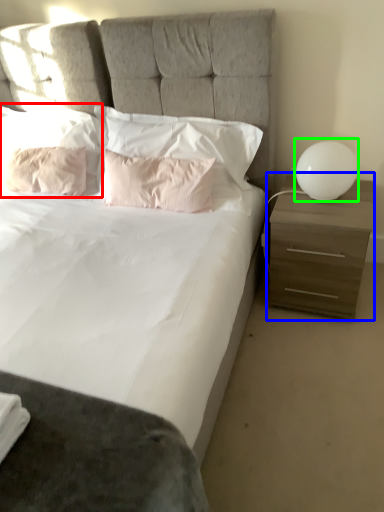
Question: Which object is positioned farthest from pillow (highlighted by a red box)? Select from nightstand (highlighted by a blue box) and table lamp (highlighted by a green box).

Choices:
 (A) nightstand
 (B) table lamp

Answer: (B)